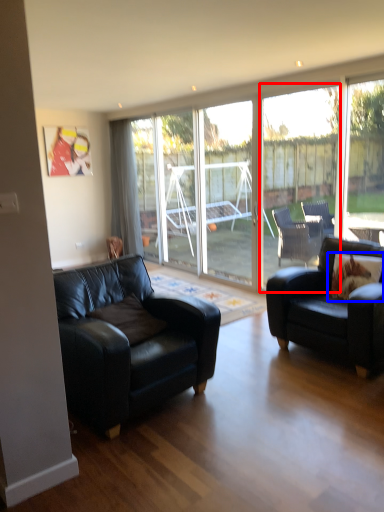
Question: Among these objects, which one is nearest to the camera, window (highlighted by a red box) or pillow (highlighted by a blue box)?

Choices:
 (A) window
 (B) pillow

Answer: (B)